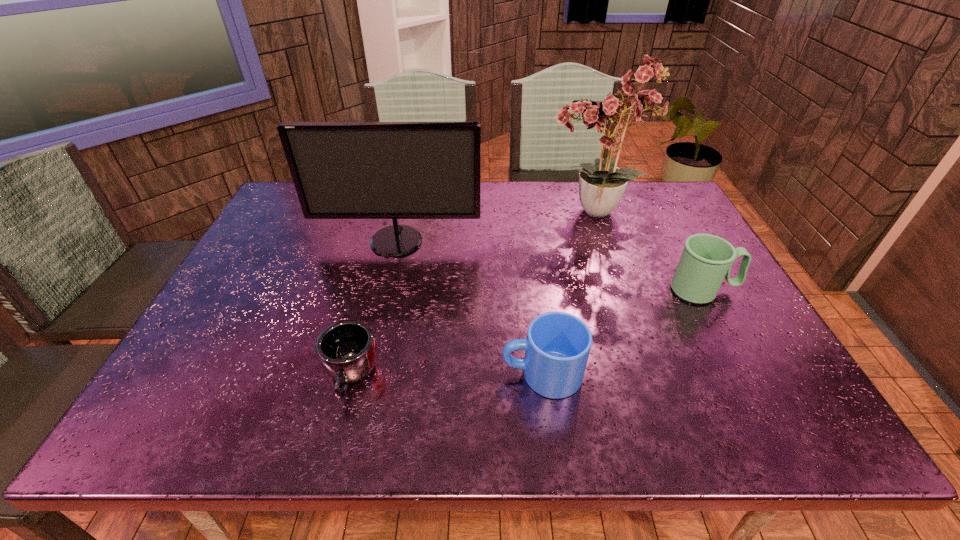
At what (x,y) coordinates should I click in order to perform the action: click on vacant space in between the rightmost mug and the computer monitor. Please return your answer as a coordinate pair (x, y). Looking at the image, I should click on (550, 266).

Locate an element on the screen. This screenshot has width=960, height=540. unoccupied area between the flower arrangement and the second mug from right to left is located at coordinates (567, 294).

Where is `free space that is in between the second tallest object and the shortest object`? This screenshot has height=540, width=960. free space that is in between the second tallest object and the shortest object is located at coordinates (373, 309).

Locate which object is the third closest to the second mug from right to left. Please provide its 2D coordinates. Your answer should be formatted as a tuple, i.e. [(x, y)], where the tuple contains the x and y coordinates of a point satisfying the conditions above.

[(341, 170)]

Locate which object ranks in proximity to the shortest mug. Please provide its 2D coordinates. Your answer should be formatted as a tuple, i.e. [(x, y)], where the tuple contains the x and y coordinates of a point satisfying the conditions above.

[(557, 346)]

Where is `mug that stands as the second closest to the farthest mug`? The width and height of the screenshot is (960, 540). mug that stands as the second closest to the farthest mug is located at coordinates (346, 350).

At what (x,y) coordinates should I click in order to perform the action: click on the closest mug relative to the third nearest object. Please return your answer as a coordinate pair (x, y). Looking at the image, I should click on (557, 346).

The image size is (960, 540). I want to click on blank space that satisfies the following two spatial constraints: 1. on the front-facing side of the flower arrangement; 2. on the front-facing side of the computer monitor, so click(x=603, y=241).

I want to click on vacant region that satisfies the following two spatial constraints: 1. on the side of the rightmost mug with the handle; 2. on the side of the shortest object with the handle, so click(x=750, y=377).

Identify the location of free space that satisfies the following two spatial constraints: 1. on the front-facing side of the tallest object; 2. on the side of the shortest mug with the handle. (649, 377).